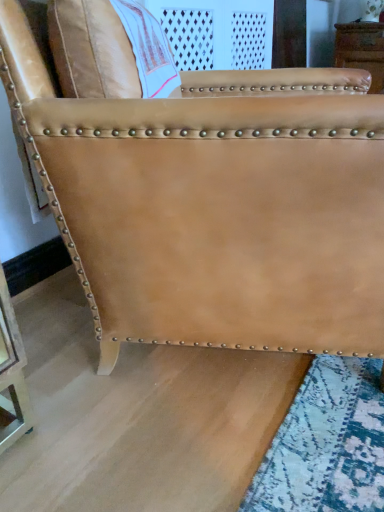
Question: Is tan leather chair at center positioned with its back to tan leather chair at upper right?

Choices:
 (A) yes
 (B) no

Answer: (B)

Question: Does tan leather chair at center have a larger size compared to tan leather chair at upper right?

Choices:
 (A) no
 (B) yes

Answer: (B)

Question: From the image's perspective, is tan leather chair at center on top of tan leather chair at upper right?

Choices:
 (A) no
 (B) yes

Answer: (A)

Question: Considering the relative sizes of tan leather chair at center and tan leather chair at upper right in the image provided, is tan leather chair at center thinner than tan leather chair at upper right?

Choices:
 (A) no
 (B) yes

Answer: (A)

Question: Is tan leather chair at center located outside tan leather chair at upper right?

Choices:
 (A) yes
 (B) no

Answer: (A)

Question: Is tan leather chair at center at the left side of tan leather chair at upper right?

Choices:
 (A) no
 (B) yes

Answer: (B)

Question: Is tan leather chair at upper right not close to tan leather chair at center?

Choices:
 (A) no
 (B) yes

Answer: (B)

Question: Is tan leather chair at upper right completely or partially outside of tan leather chair at center?

Choices:
 (A) no
 (B) yes

Answer: (B)

Question: Can you confirm if tan leather chair at upper right is shorter than tan leather chair at center?

Choices:
 (A) no
 (B) yes

Answer: (B)

Question: Is the position of tan leather chair at upper right less distant than that of tan leather chair at center?

Choices:
 (A) no
 (B) yes

Answer: (A)

Question: From a real-world perspective, is tan leather chair at upper right positioned under tan leather chair at center based on gravity?

Choices:
 (A) yes
 (B) no

Answer: (B)

Question: Does tan leather chair at upper right appear on the left side of tan leather chair at center?

Choices:
 (A) no
 (B) yes

Answer: (A)

Question: Is tan leather chair at upper right wider or thinner than tan leather chair at center?

Choices:
 (A) wide
 (B) thin

Answer: (B)